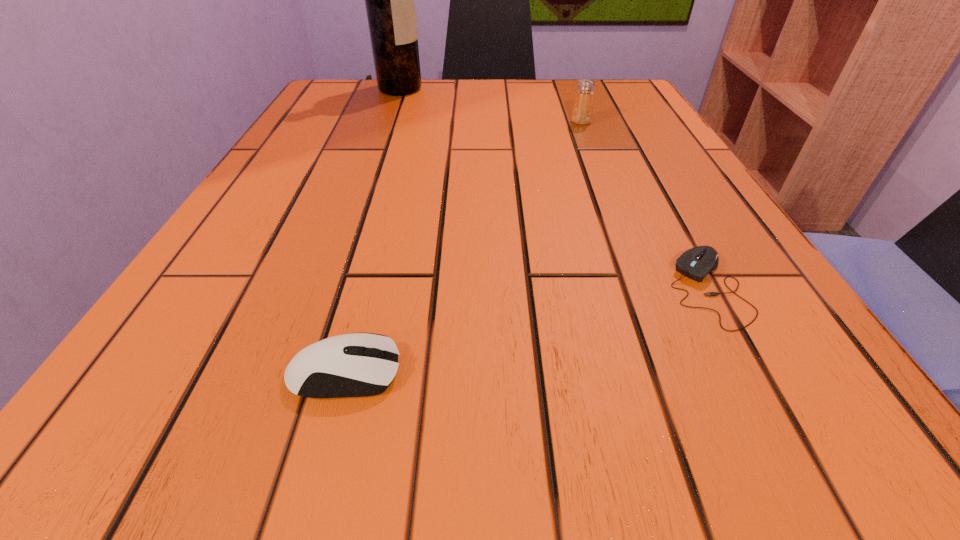
Where is `liquor`? liquor is located at coordinates (389, 0).

Image resolution: width=960 pixels, height=540 pixels. What are the coordinates of `the tallest object` in the screenshot? It's located at (x=389, y=0).

This screenshot has height=540, width=960. In order to click on the third nearest object in this screenshot , I will do `click(582, 111)`.

In order to click on the second object from right to left in this screenshot , I will do `click(582, 111)`.

Where is `the nearer computer mouse`? The width and height of the screenshot is (960, 540). the nearer computer mouse is located at coordinates (350, 365).

Locate an element on the screen. This screenshot has height=540, width=960. the taller computer mouse is located at coordinates (350, 365).

What are the coordinates of `the shorter computer mouse` in the screenshot? It's located at 696,263.

At what (x,y) coordinates should I click in order to perform the action: click on the right computer mouse. Please return your answer as a coordinate pair (x, y). Image resolution: width=960 pixels, height=540 pixels. Looking at the image, I should click on (696, 263).

I want to click on free space located on the front-facing side of the liquor, so click(489, 89).

The image size is (960, 540). Find the location of `vacant space situated on the right of the third nearest object`. vacant space situated on the right of the third nearest object is located at coordinates (649, 122).